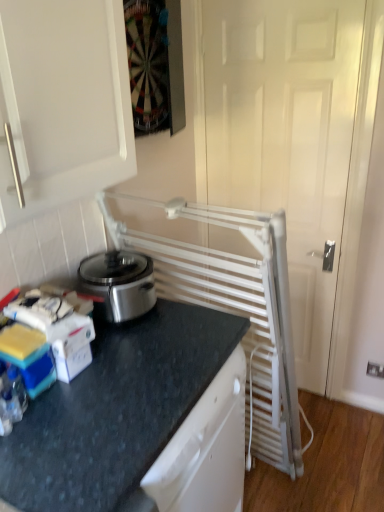
Identify the location of free spot above black granite countertop at lower left (from a real-world perspective). (145, 357).